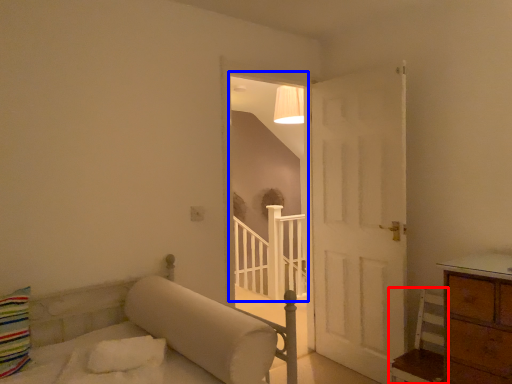
Question: Among these objects, which one is farthest to the camera, furniture (highlighted by a red box) or window (highlighted by a blue box)?

Choices:
 (A) furniture
 (B) window

Answer: (B)